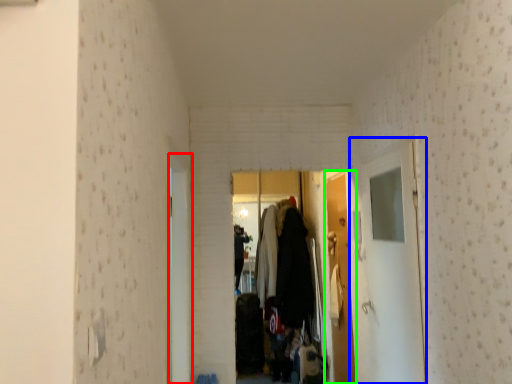
Question: Considering the real-world distances, which object is closest to door (highlighted by a red box)? glass door (highlighted by a blue box) or door (highlighted by a green box).

Choices:
 (A) glass door
 (B) door

Answer: (A)